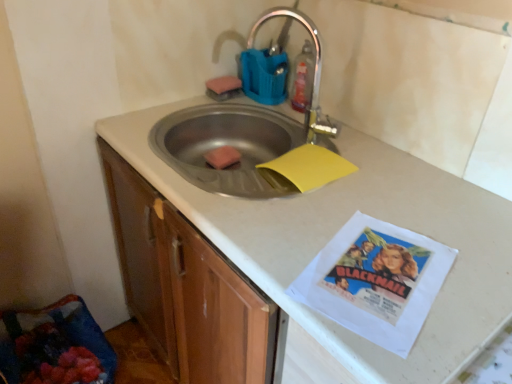
What do you see at coordinates (339, 228) in the screenshot? The width and height of the screenshot is (512, 384). I see `white matte countertop at center` at bounding box center [339, 228].

In order to click on white matte countertop at center in this screenshot , I will do pyautogui.click(x=339, y=228).

In order to face pink sponge at sink, the first food ordered from the bottom, should I rotate leftwards or rightwards?

Rotate your view left by about 3.970°.

The height and width of the screenshot is (384, 512). Describe the element at coordinates (223, 84) in the screenshot. I see `pink sponge at upper center, placed as the second food when sorted from bottom to top` at that location.

Image resolution: width=512 pixels, height=384 pixels. I want to click on translucent plastic bottle at upper center, so click(303, 78).

Could you tell me if pink sponge at sink, the first food ordered from the bottom, is turned towards yellow matte paper at sink?

No, pink sponge at sink, the first food ordered from the bottom, is not oriented towards yellow matte paper at sink.

Would you say pink sponge at sink, the second food when ordered from top to bottom, contains yellow matte paper at sink?

No, yellow matte paper at sink is not surrounded by pink sponge at sink, the second food when ordered from top to bottom.

Considering the relative positions of pink sponge at sink, the second food when ordered from top to bottom, and yellow matte paper at sink in the image provided, is pink sponge at sink, the second food when ordered from top to bottom, to the right of yellow matte paper at sink from the viewer's perspective?

Incorrect, pink sponge at sink, the second food when ordered from top to bottom, is not on the right side of yellow matte paper at sink.

What's the angular difference between pink sponge at sink, the first food ordered from the bottom, and yellow matte paper at sink's facing directions?

The facing directions of pink sponge at sink, the first food ordered from the bottom, and yellow matte paper at sink are 4.06 degrees apart.

Is translucent plastic bottle at upper center taller or shorter than pink sponge at upper center, placed as the second food when sorted from bottom to top?

Clearly, translucent plastic bottle at upper center is taller compared to pink sponge at upper center, placed as the second food when sorted from bottom to top.

Which is more to the right, translucent plastic bottle at upper center or pink sponge at upper center, the 1th food viewed from the top?

translucent plastic bottle at upper center is more to the right.

Is translucent plastic bottle at upper center bigger than pink sponge at upper center, placed as the second food when sorted from bottom to top?

Yes, translucent plastic bottle at upper center is bigger than pink sponge at upper center, placed as the second food when sorted from bottom to top.

Is translucent plastic bottle at upper center positioned before pink sponge at upper center, placed as the second food when sorted from bottom to top?

Yes, the depth of translucent plastic bottle at upper center is less than that of pink sponge at upper center, placed as the second food when sorted from bottom to top.

How distant is pink sponge at upper center, placed as the second food when sorted from bottom to top, from yellow matte paper at sink?

pink sponge at upper center, placed as the second food when sorted from bottom to top, and yellow matte paper at sink are 19.49 inches apart from each other.

From the image's perspective, between pink sponge at upper center, the 1th food viewed from the top, and yellow matte paper at sink, who is located below?

yellow matte paper at sink, from the image's perspective.

Based on the photo, does pink sponge at upper center, placed as the second food when sorted from bottom to top, come in front of yellow matte paper at sink?

No, it is not.

Looking at this image, which of these two, pink sponge at upper center, the 1th food viewed from the top, or yellow matte paper at sink, is smaller?

pink sponge at upper center, the 1th food viewed from the top, is smaller.

Is the position of translucent plastic bottle at upper center less distant than that of white matte countertop at center?

No, it is behind white matte countertop at center.

Visually, is translucent plastic bottle at upper center positioned to the left or to the right of white matte countertop at center?

translucent plastic bottle at upper center is positioned on white matte countertop at center's right side.

Between translucent plastic bottle at upper center and white matte countertop at center, which one has more height?

Standing taller between the two is white matte countertop at center.

Does translucent plastic bottle at upper center come in front of pink sponge at sink, the second food when ordered from top to bottom?

Yes, it is.

Does translucent plastic bottle at upper center have a lesser height compared to pink sponge at sink, the first food ordered from the bottom?

In fact, translucent plastic bottle at upper center may be taller than pink sponge at sink, the first food ordered from the bottom.

Which of these two, translucent plastic bottle at upper center or pink sponge at sink, the first food ordered from the bottom, is bigger?

With larger size is translucent plastic bottle at upper center.

Considering the sizes of objects yellow matte paper at sink and translucent plastic bottle at upper center in the image provided, who is shorter, yellow matte paper at sink or translucent plastic bottle at upper center?

With less height is yellow matte paper at sink.

Is point (303, 189) positioned behind point (306, 80)?

No, it is in front of (306, 80).

Identify the location of cleaning product lying behind the yellow matte paper at sink. (303, 78).

How distant is pink sponge at upper center, the 1th food viewed from the top, from white matte countertop at center?

The distance of pink sponge at upper center, the 1th food viewed from the top, from white matte countertop at center is 27.98 inches.

Can you tell me how much pink sponge at upper center, placed as the second food when sorted from bottom to top, and white matte countertop at center differ in facing direction?

They differ by 88.2 degrees in their facing directions.

Between pink sponge at upper center, the 1th food viewed from the top, and white matte countertop at center, which one has larger width?

white matte countertop at center.

Which is in front, point (211, 83) or point (489, 246)?

The point (489, 246) is in front.

Locate an element on the screen. The height and width of the screenshot is (384, 512). paper on the right of pink sponge at sink, the second food when ordered from top to bottom is located at coordinates (305, 169).

Locate an element on the screen. This screenshot has width=512, height=384. the 1st food located beneath the translucent plastic bottle at upper center (from a real-world perspective) is located at coordinates (223, 84).

Looking at the image, which one is located closer to pink sponge at upper center, placed as the second food when sorted from bottom to top, yellow matte paper at sink or pink sponge at sink, the second food when ordered from top to bottom?

The object closer to pink sponge at upper center, placed as the second food when sorted from bottom to top, is pink sponge at sink, the second food when ordered from top to bottom.

Considering their positions, is white matte countertop at center positioned further to pink sponge at upper center, placed as the second food when sorted from bottom to top, than translucent plastic bottle at upper center?

white matte countertop at center.

Estimate the real-world distances between objects in this image. Which object is closer to pink sponge at upper center, placed as the second food when sorted from bottom to top, pink sponge at sink, the second food when ordered from top to bottom, or white matte countertop at center?

Based on the image, pink sponge at sink, the second food when ordered from top to bottom, appears to be nearer to pink sponge at upper center, placed as the second food when sorted from bottom to top.

Based on the photo, which object lies further to the anchor point white matte countertop at center, pink sponge at sink, the second food when ordered from top to bottom, or pink sponge at upper center, the 1th food viewed from the top?

The object further to white matte countertop at center is pink sponge at upper center, the 1th food viewed from the top.

From the image, which object appears to be farther from translucent plastic bottle at upper center, white matte countertop at center or pink sponge at sink, the first food ordered from the bottom?

white matte countertop at center.

Estimate the real-world distances between objects in this image. Which object is closer to translucent plastic bottle at upper center, white matte countertop at center or pink sponge at upper center, placed as the second food when sorted from bottom to top?

The object closer to translucent plastic bottle at upper center is pink sponge at upper center, placed as the second food when sorted from bottom to top.

From the image, which object appears to be farther from pink sponge at upper center, placed as the second food when sorted from bottom to top, translucent plastic bottle at upper center or pink sponge at sink, the first food ordered from the bottom?

Based on the image, translucent plastic bottle at upper center appears to be further to pink sponge at upper center, placed as the second food when sorted from bottom to top.

When comparing their distances from pink sponge at sink, the first food ordered from the bottom, does pink sponge at upper center, the 1th food viewed from the top, or white matte countertop at center seem closer?

Based on the image, pink sponge at upper center, the 1th food viewed from the top, appears to be nearer to pink sponge at sink, the first food ordered from the bottom.

Find the location of a particular element. This screenshot has width=512, height=384. food between white matte countertop at center and pink sponge at upper center, the 1th food viewed from the top, from front to back is located at coordinates (222, 157).

Locate an element on the screen. paper between white matte countertop at center and translucent plastic bottle at upper center in the front-back direction is located at coordinates (305, 169).

At what (x,y) coordinates should I click in order to perform the action: click on food between yellow matte paper at sink and pink sponge at upper center, the 1th food viewed from the top, in the front-back direction. Please return your answer as a coordinate pair (x, y). Looking at the image, I should click on (222, 157).

You are a GUI agent. You are given a task and a screenshot of the screen. Output one action in this format:
    pyautogui.click(x=<x>, y=<y>)
    Task: Click on the cleaning product between yellow matte paper at sink and pink sponge at upper center, the 1th food viewed from the top, in the front-back direction
    
    Given the screenshot: What is the action you would take?
    pyautogui.click(x=303, y=78)